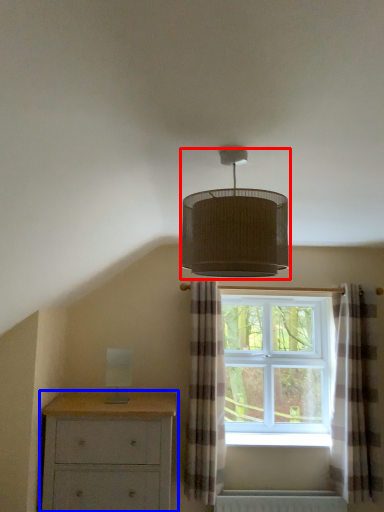
Question: Which point is closer to the camera, lamp (highlighted by a red box) or chest of drawers (highlighted by a blue box)?

Choices:
 (A) lamp
 (B) chest of drawers

Answer: (A)